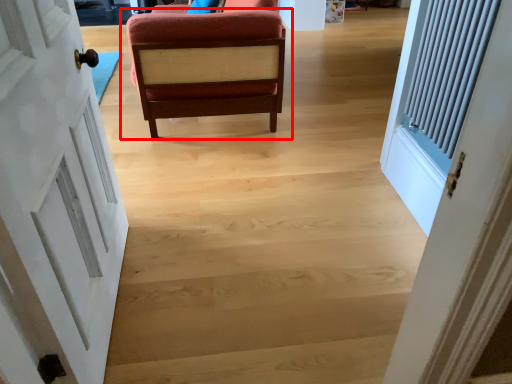
Question: From the image's perspective, where is chair (annotated by the red box) located in relation to door in the image?

Choices:
 (A) below
 (B) above

Answer: (B)